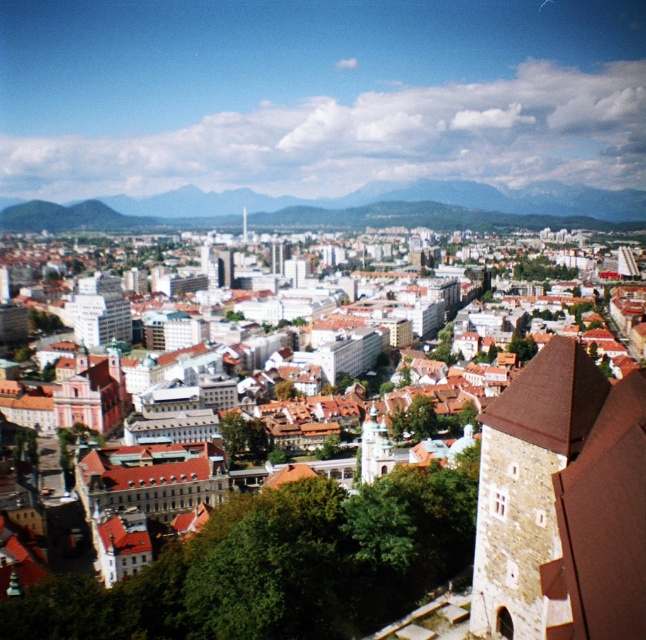
Can you confirm if brown stone tower at right is positioned to the left of green grassy hill at center?

No, brown stone tower at right is not to the left of green grassy hill at center.

Which is in front, point (576, 355) or point (461, 196)?

Positioned in front is point (576, 355).

Who is more forward, (501, 540) or (307, 211)?

Positioned in front is point (501, 540).

You are a GUI agent. You are given a task and a screenshot of the screen. Output one action in this format:
    pyautogui.click(x=<x>, y=<y>)
    Task: Click on the brown stone tower at right
    The width and height of the screenshot is (646, 640).
    Given the screenshot: What is the action you would take?
    pyautogui.click(x=526, y=483)